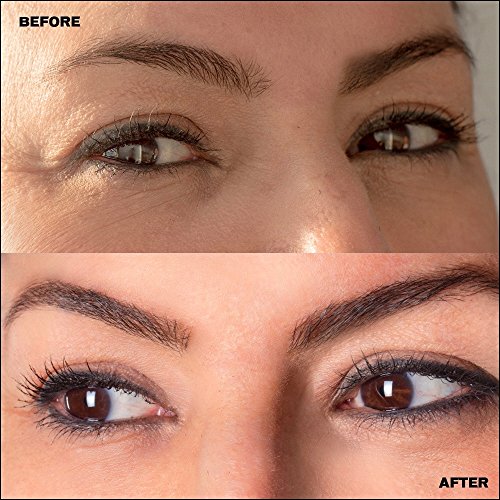
At what (x,y) coordinates should I click in order to perform the action: click on grey wall. Please return your answer as a coordinate pair (x, y). This screenshot has height=500, width=500. Looking at the image, I should click on (488, 12), (487, 118).